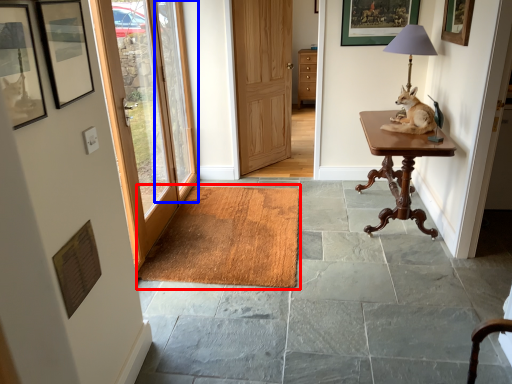
Question: Which of the following is the closest to the observer, doormat (highlighted by a red box) or window (highlighted by a blue box)?

Choices:
 (A) doormat
 (B) window

Answer: (A)